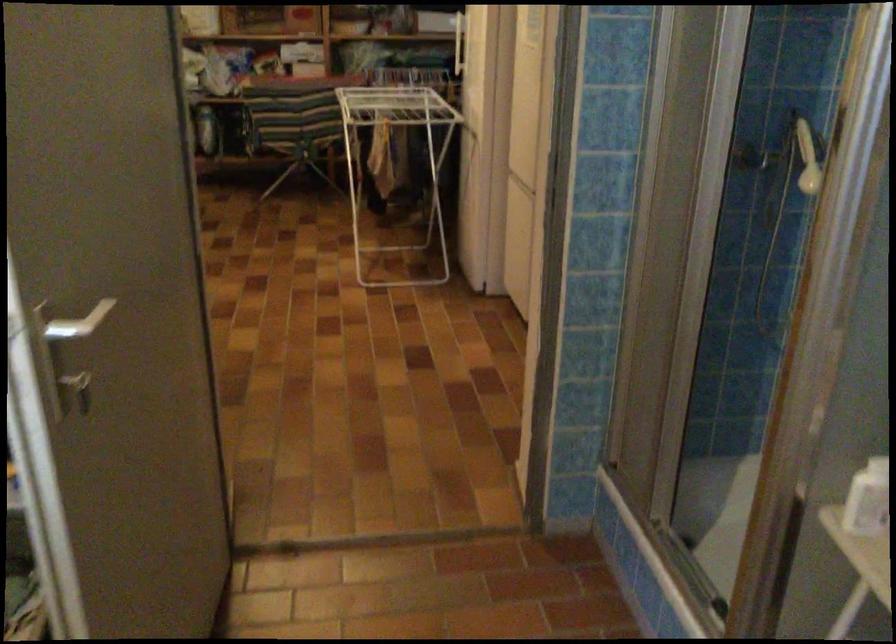
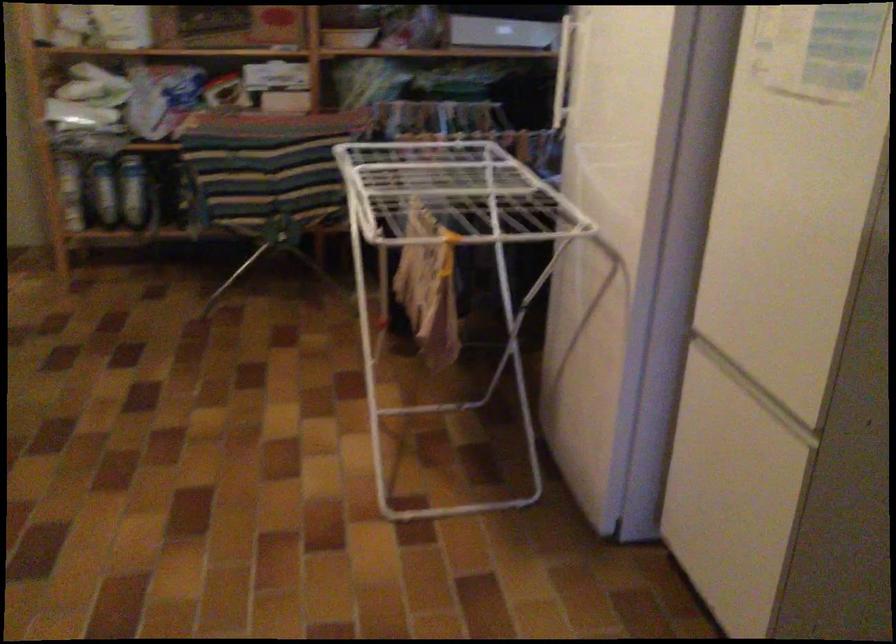
Question: Which direction would the cameraman need to move to produce the second image? Reply with the corresponding letter.

Choices:
 (A) Left
 (B) Right
 (C) Forward
 (D) Backward

Answer: (C)